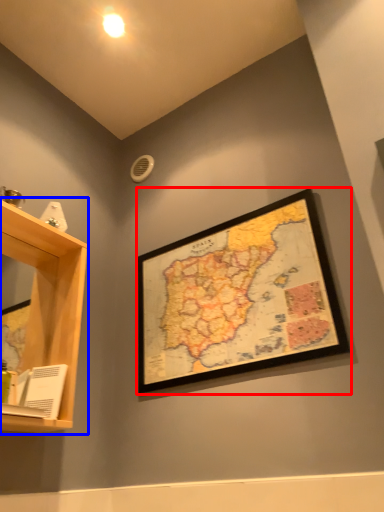
Question: Which of the following is the closest to the observer, picture frame (highlighted by a red box) or shelf (highlighted by a blue box)?

Choices:
 (A) picture frame
 (B) shelf

Answer: (B)